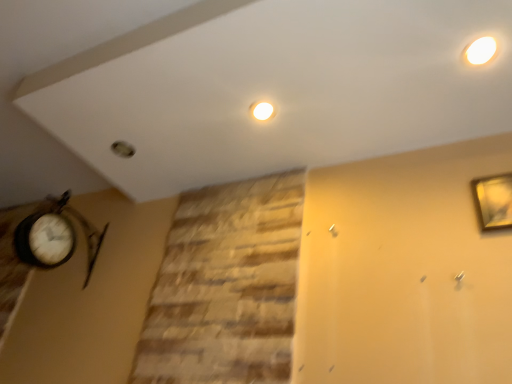
Identify the location of white glossy light fixture at upper right. (481, 50).

This screenshot has height=384, width=512. Describe the element at coordinates (481, 50) in the screenshot. I see `white glossy light fixture at upper right` at that location.

Identify the location of gold metallic picture frame at upper right. (493, 201).

Image resolution: width=512 pixels, height=384 pixels. What do you see at coordinates (493, 201) in the screenshot?
I see `gold metallic picture frame at upper right` at bounding box center [493, 201].

Identify the location of white glossy light fixture at upper right. The width and height of the screenshot is (512, 384). (481, 50).

Considering the relative positions of white glossy light fixture at upper right and gold metallic picture frame at upper right in the image provided, is white glossy light fixture at upper right to the right of gold metallic picture frame at upper right from the viewer's perspective?

In fact, white glossy light fixture at upper right is to the left of gold metallic picture frame at upper right.

Is the position of white glossy light fixture at upper right less distant than that of gold metallic picture frame at upper right?

Yes, white glossy light fixture at upper right is closer to the viewer.

Does point (492, 49) lie in front of point (506, 222)?

Yes, point (492, 49) is in front of point (506, 222).

From the image's perspective, which one is positioned lower, white glossy light fixture at upper right or gold metallic picture frame at upper right?

gold metallic picture frame at upper right appears lower in the image.

From a real-world perspective, is white glossy light fixture at upper right located higher than gold metallic picture frame at upper right?

Correct, in the physical world, white glossy light fixture at upper right is higher than gold metallic picture frame at upper right.

Is white glossy light fixture at upper right wider or thinner than gold metallic picture frame at upper right?

Considering their sizes, white glossy light fixture at upper right looks broader than gold metallic picture frame at upper right.

Considering the sizes of objects white glossy light fixture at upper right and gold metallic picture frame at upper right in the image provided, who is taller, white glossy light fixture at upper right or gold metallic picture frame at upper right?

With more height is gold metallic picture frame at upper right.

Between white glossy light fixture at upper right and gold metallic picture frame at upper right, which one has smaller size?

With smaller size is white glossy light fixture at upper right.

Is white glossy light fixture at upper right positioned beyond the bounds of gold metallic picture frame at upper right?

white glossy light fixture at upper right is positioned outside gold metallic picture frame at upper right.

Is white glossy light fixture at upper right in contact with gold metallic picture frame at upper right?

No, white glossy light fixture at upper right is not beside gold metallic picture frame at upper right.

Is white glossy light fixture at upper right turned away from gold metallic picture frame at upper right?

No, white glossy light fixture at upper right is not facing away from gold metallic picture frame at upper right.

What's the angular difference between white glossy light fixture at upper right and gold metallic picture frame at upper right's facing directions?

They differ by 89.8 degrees in their facing directions.

Measure the distance from white glossy light fixture at upper right to gold metallic picture frame at upper right.

white glossy light fixture at upper right and gold metallic picture frame at upper right are 13.70 inches apart.

Where is `lighting above the gold metallic picture frame at upper right (from a real-world perspective)`? Image resolution: width=512 pixels, height=384 pixels. lighting above the gold metallic picture frame at upper right (from a real-world perspective) is located at coordinates (481, 50).

Is gold metallic picture frame at upper right at the left side of white glossy light fixture at upper right?

No.

Considering the relative positions of gold metallic picture frame at upper right and white glossy light fixture at upper right in the image provided, is gold metallic picture frame at upper right behind white glossy light fixture at upper right?

Yes, gold metallic picture frame at upper right is further from the viewer.

Which is farther from the camera, [477,179] or [473,61]?

The point [477,179] is farther from the camera.

Consider the image. From the image's perspective, is gold metallic picture frame at upper right under white glossy light fixture at upper right?

Correct, gold metallic picture frame at upper right appears lower than white glossy light fixture at upper right in the image.

Consider the image. From a real-world perspective, is gold metallic picture frame at upper right above or below white glossy light fixture at upper right?

Clearly, from a real-world perspective, gold metallic picture frame at upper right is below white glossy light fixture at upper right.

Does gold metallic picture frame at upper right have a greater width compared to white glossy light fixture at upper right?

Incorrect, the width of gold metallic picture frame at upper right does not surpass that of white glossy light fixture at upper right.

Considering the relative sizes of gold metallic picture frame at upper right and white glossy light fixture at upper right in the image provided, is gold metallic picture frame at upper right shorter than white glossy light fixture at upper right?

Incorrect, the height of gold metallic picture frame at upper right does not fall short of that of white glossy light fixture at upper right.

Looking at this image, looking at the image, does gold metallic picture frame at upper right seem bigger or smaller compared to white glossy light fixture at upper right?

Considering their sizes, gold metallic picture frame at upper right takes up more space than white glossy light fixture at upper right.

Choose the correct answer: Is gold metallic picture frame at upper right inside white glossy light fixture at upper right or outside it?

gold metallic picture frame at upper right is outside white glossy light fixture at upper right.

Does gold metallic picture frame at upper right touch white glossy light fixture at upper right?

No, gold metallic picture frame at upper right is not making contact with white glossy light fixture at upper right.

Is gold metallic picture frame at upper right facing away from white glossy light fixture at upper right?

gold metallic picture frame at upper right does not have its back to white glossy light fixture at upper right.

What's the angular difference between gold metallic picture frame at upper right and white glossy light fixture at upper right's facing directions?

The angular difference between gold metallic picture frame at upper right and white glossy light fixture at upper right is 89.8 degrees.

Find the location of a particular element. Image resolution: width=512 pixels, height=384 pixels. lighting above the gold metallic picture frame at upper right (from the image's perspective) is located at coordinates (481, 50).

Image resolution: width=512 pixels, height=384 pixels. Identify the location of picture frame below the white glossy light fixture at upper right (from a real-world perspective). (493, 201).

You are a GUI agent. You are given a task and a screenshot of the screen. Output one action in this format:
    pyautogui.click(x=<x>, y=<y>)
    Task: Click on the picture frame on the right of white glossy light fixture at upper right
    The image size is (512, 384).
    Given the screenshot: What is the action you would take?
    pos(493,201)